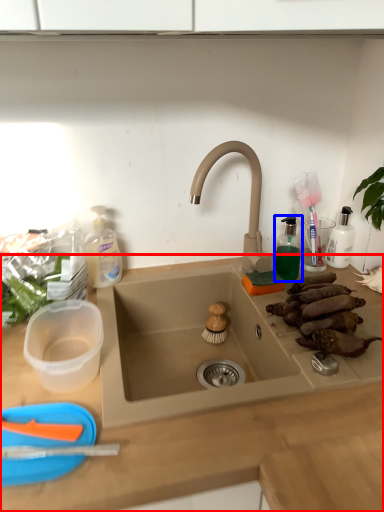
Question: Among these objects, which one is nearest to the camera, countertop (highlighted by a red box) or toiletry (highlighted by a blue box)?

Choices:
 (A) countertop
 (B) toiletry

Answer: (A)